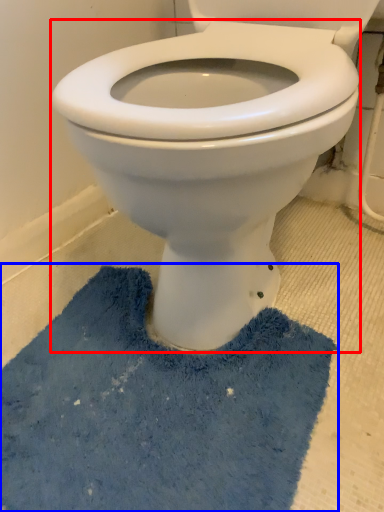
Question: Which object is closer to the camera taking this photo, bidet (highlighted by a red box) or bath mat (highlighted by a blue box)?

Choices:
 (A) bidet
 (B) bath mat

Answer: (A)